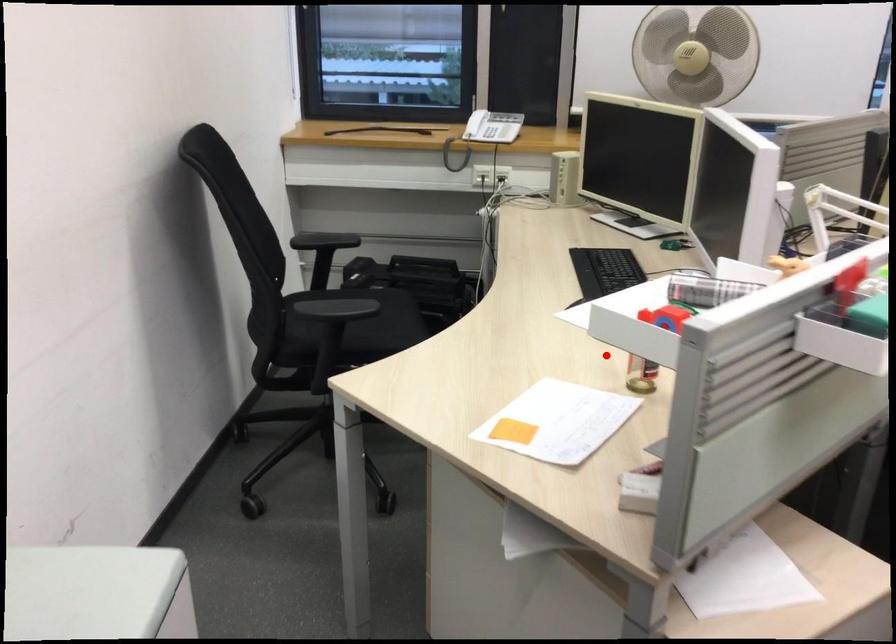
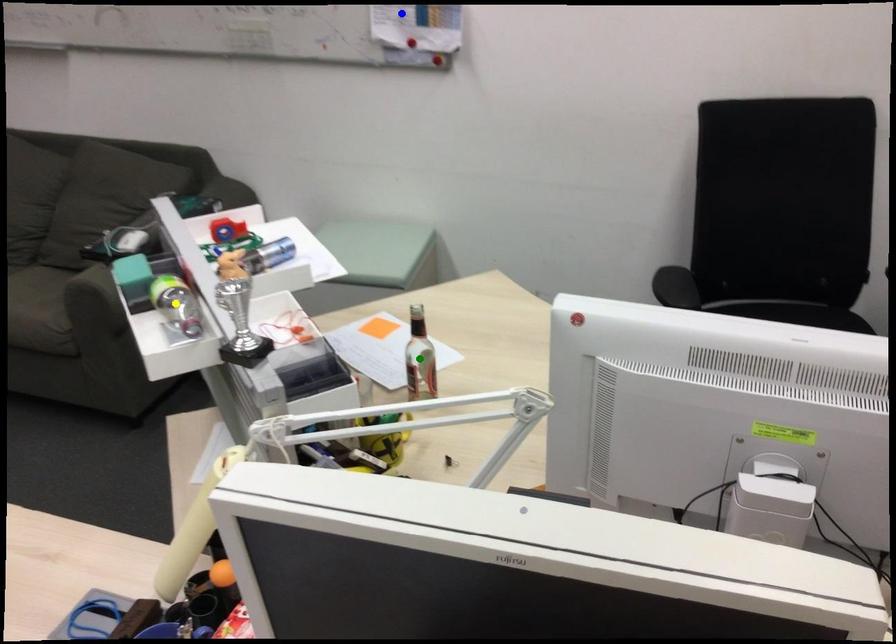
Question: I am providing you with two images of the same scene from different viewpoints. A red point is marked on the first image. You are given multiple points on the second image. Which point in image 2 represents the same 3d spot as the red point in image 1?

Choices:
 (A) blue point
 (B) yellow point
 (C) green point

Answer: (C)